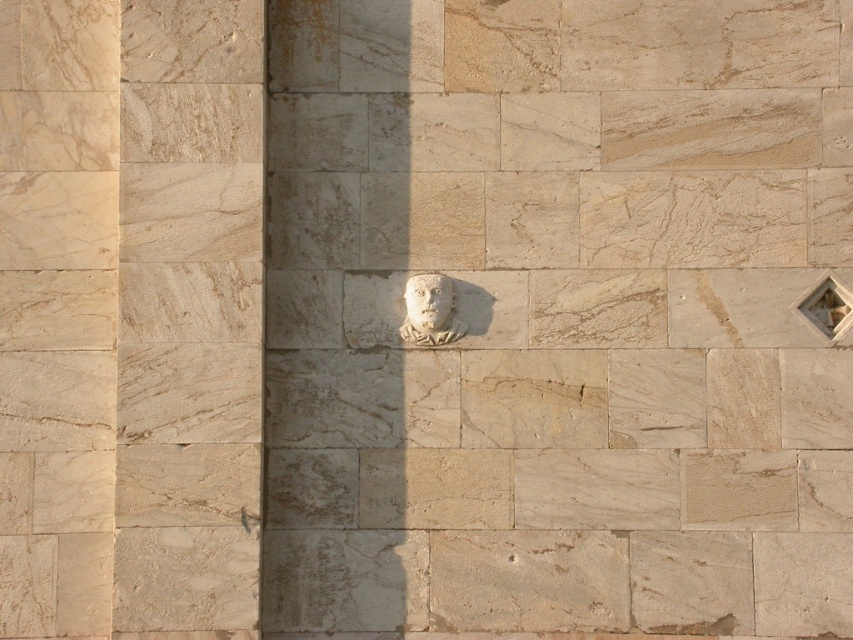
Is white stone bust at center positioned before white stone face at center?

No, white stone bust at center is behind white stone face at center.

Between white stone bust at center and white stone face at center, which one has more height?

With more height is white stone bust at center.

Is point (421, 340) closer to camera compared to point (436, 308)?

No, it is behind (436, 308).

Where is `white stone bust at center`? white stone bust at center is located at coordinates (430, 310).

Is beige marble pillar at center bigger than white stone bust at center?

Yes, beige marble pillar at center is bigger than white stone bust at center.

At what (x,y) coordinates should I click in order to perform the action: click on beige marble pillar at center. Please return your answer as a coordinate pair (x, y). The height and width of the screenshot is (640, 853). Looking at the image, I should click on (129, 317).

Is point (105, 444) behind point (451, 285)?

No.

Identify the location of beige marble pillar at center. The image size is (853, 640). (129, 317).

From the picture: Does beige marble pillar at center have a greater height compared to white stone face at center?

Indeed, beige marble pillar at center has a greater height compared to white stone face at center.

Between beige marble pillar at center and white stone face at center, which one is positioned lower?

beige marble pillar at center is below.

Who is more forward, (196, 483) or (413, 289)?

Point (196, 483)

This screenshot has width=853, height=640. I want to click on beige marble pillar at center, so click(129, 317).